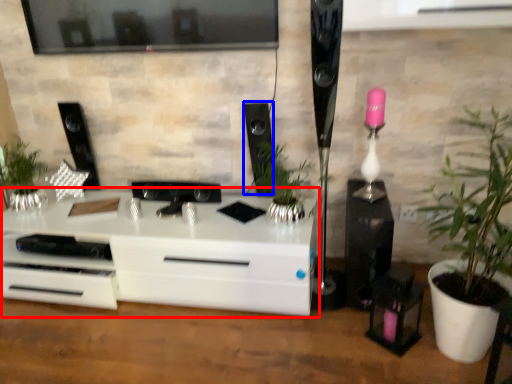
Question: Which object appears farthest to the camera in this image, chest of drawers (highlighted by a red box) or speaker (highlighted by a blue box)?

Choices:
 (A) chest of drawers
 (B) speaker

Answer: (B)